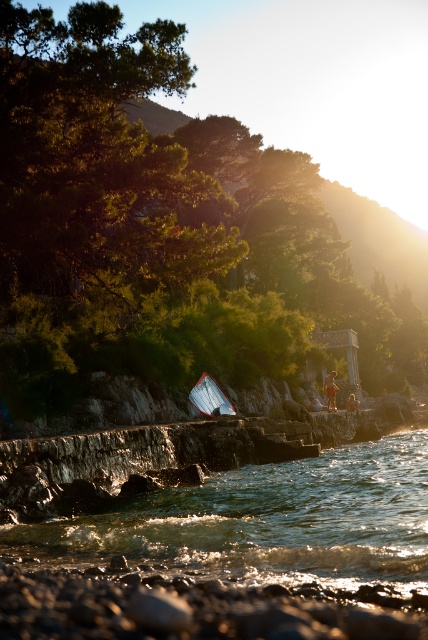
You are a photographer setting up a tripod to capture the white plastic boat at center and the smooth pebbles at lower center. Based on their positions, which object should you focus on first if you want to include both in your shot without moving the tripod?

The white plastic boat at center is positioned to the left of the smooth pebbles at lower center, so you should focus on the white plastic boat at center first to ensure both are in frame without moving the tripod.

You are standing on the rocky shoreline in the coastal scene. You see the clear water at lower center and the tan fabric shorts at lower right. Which object is higher up from the bottom of the image?

The clear water at lower center is taller than the tan fabric shorts at lower right, so the clear water at lower center is higher up from the bottom of the image.

You are standing on the stone walkway and see the white plastic boat at center and the brown leather jacket at center. Which object is higher up in the image?

The white plastic boat at center is taller than the brown leather jacket at center, so the white plastic boat at center is higher up in the image.